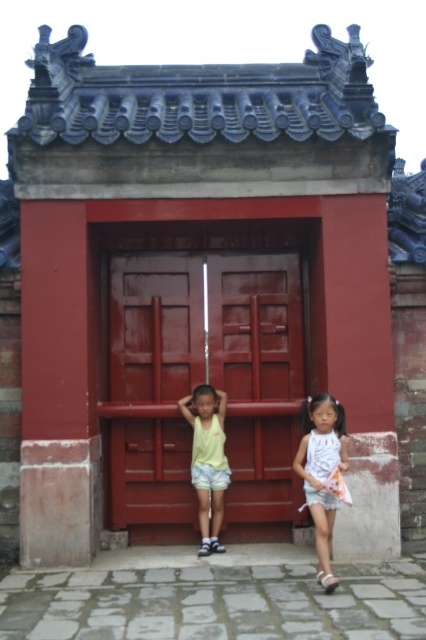
Is matte wood door at center bigger than white cotton dress at center?

Yes.

Is point (167, 426) positioned after point (328, 497)?

Yes, point (167, 426) is farther from viewer.

This screenshot has width=426, height=640. In order to click on matte wood door at center in this screenshot , I will do `click(204, 380)`.

The width and height of the screenshot is (426, 640). I want to click on matte wood door at center, so click(x=204, y=380).

Is point (242, 257) farther from viewer compared to point (193, 392)?

Yes, point (242, 257) is behind point (193, 392).

Which of these two, matte wood door at center or yellow fabric shirt at center, stands shorter?

yellow fabric shirt at center is shorter.

Is point (175, 307) positioned after point (221, 449)?

Yes, point (175, 307) is farther from viewer.

This screenshot has height=640, width=426. Identify the location of matte wood door at center. (204, 380).

Who is taller, white cotton dress at center or yellow fabric shirt at center?

Standing taller between the two is yellow fabric shirt at center.

Is white cotton dress at center smaller than yellow fabric shirt at center?

No, white cotton dress at center is not smaller than yellow fabric shirt at center.

Does point (330, 548) come farther from viewer compared to point (221, 513)?

No, it is not.

Identify the location of white cotton dress at center. Image resolution: width=426 pixels, height=640 pixels. (322, 472).